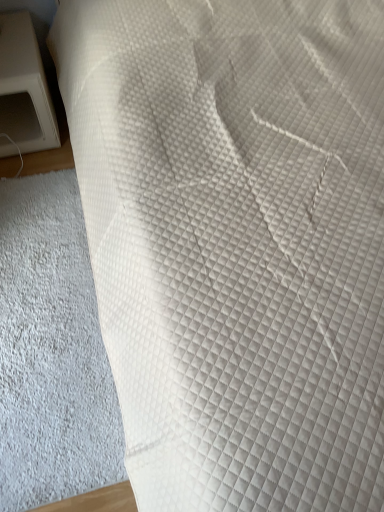
Question: Does white quilted fabric at lower left come behind white plastic microwave at left?

Choices:
 (A) no
 (B) yes

Answer: (A)

Question: Considering the relative sizes of white quilted fabric at lower left and white plastic microwave at left in the image provided, is white quilted fabric at lower left taller than white plastic microwave at left?

Choices:
 (A) yes
 (B) no

Answer: (B)

Question: From a real-world perspective, is white quilted fabric at lower left below white plastic microwave at left?

Choices:
 (A) no
 (B) yes

Answer: (B)

Question: Can you confirm if white quilted fabric at lower left is wider than white plastic microwave at left?

Choices:
 (A) yes
 (B) no

Answer: (A)

Question: Does white quilted fabric at lower left have a lesser height compared to white plastic microwave at left?

Choices:
 (A) no
 (B) yes

Answer: (B)

Question: Can you confirm if white quilted fabric at lower left is positioned to the right of white plastic microwave at left?

Choices:
 (A) yes
 (B) no

Answer: (A)

Question: Can you see white plastic microwave at left touching white quilted fabric at lower left?

Choices:
 (A) no
 (B) yes

Answer: (A)

Question: Could white quilted fabric at lower left be considered to be inside white plastic microwave at left?

Choices:
 (A) no
 (B) yes

Answer: (A)

Question: Is white plastic microwave at left far away from white quilted fabric at lower left?

Choices:
 (A) yes
 (B) no

Answer: (B)

Question: Is white plastic microwave at left completely or partially outside of white quilted fabric at lower left?

Choices:
 (A) yes
 (B) no

Answer: (A)

Question: Can you confirm if white plastic microwave at left is shorter than white quilted fabric at lower left?

Choices:
 (A) yes
 (B) no

Answer: (B)

Question: Can you confirm if white plastic microwave at left is positioned to the right of white quilted fabric at lower left?

Choices:
 (A) yes
 (B) no

Answer: (B)

Question: Considering the positions of point 31,116 and point 46,217, is point 31,116 closer or farther from the camera than point 46,217?

Choices:
 (A) closer
 (B) farther

Answer: (B)